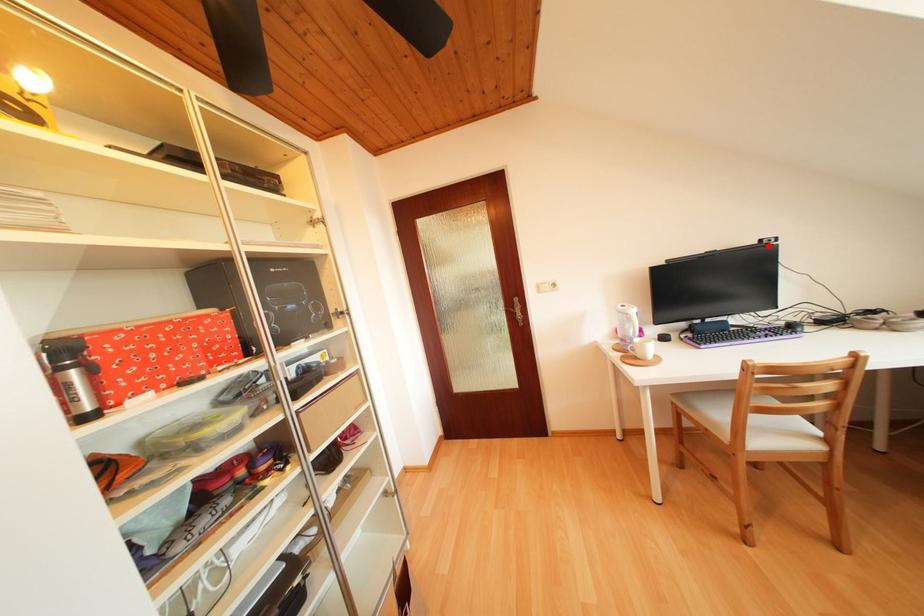
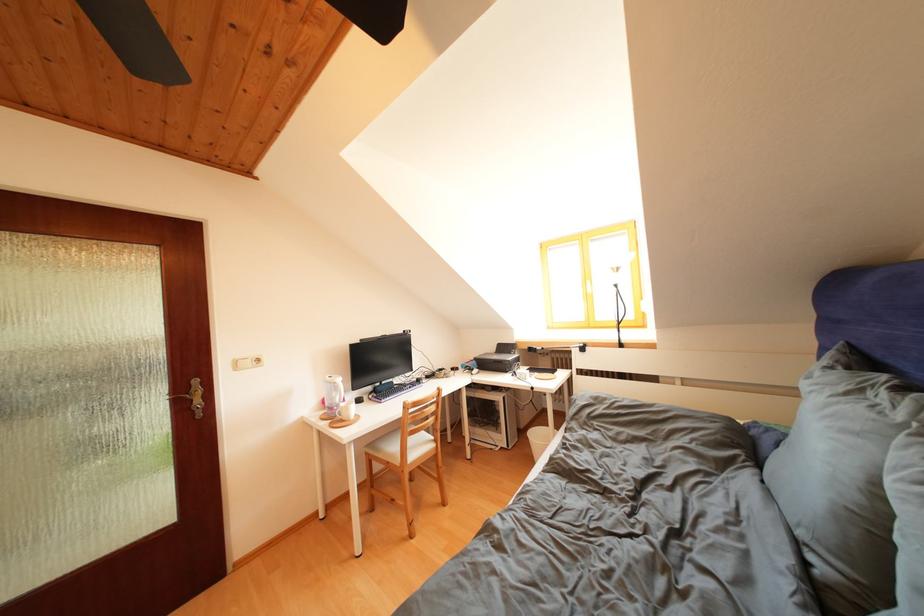
Where in the second image is the point corresponding to the highlighted location from the first image?

(411, 337)